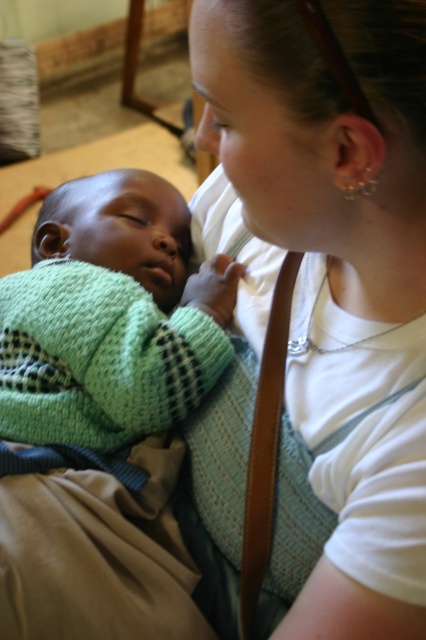
Question: Is knitted green sweater at center-left below brown leather strap at center?

Choices:
 (A) yes
 (B) no

Answer: (B)

Question: Based on their relative distances, which object is nearer to the knitted green sweater at center-left?

Choices:
 (A) brown leather strap at center
 (B) white fabric at upper right

Answer: (B)

Question: Considering the real-world distances, which object is closest to the white fabric at upper right?

Choices:
 (A) brown leather strap at center
 (B) knitted green sweater at center-left

Answer: (A)

Question: Based on their relative distances, which object is nearer to the knitted green sweater at center-left?

Choices:
 (A) white fabric at upper right
 (B) brown leather strap at center

Answer: (A)

Question: Observing the image, what is the correct spatial positioning of white fabric at upper right in reference to brown leather strap at center?

Choices:
 (A) below
 (B) above

Answer: (B)

Question: Can you confirm if knitted green sweater at center-left is wider than brown leather strap at center?

Choices:
 (A) no
 (B) yes

Answer: (B)